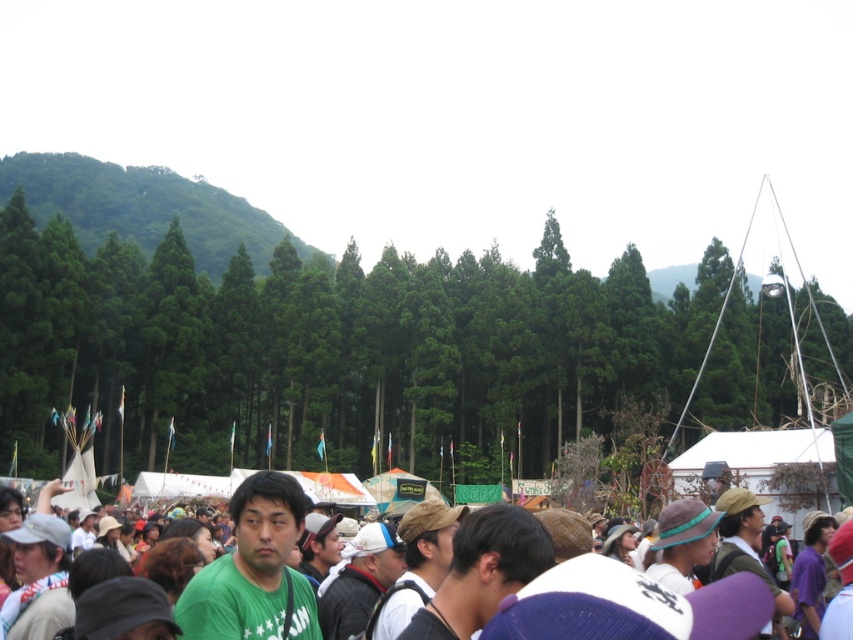
You are standing at the origin point of the coordinate system in the image. You want to move towards the green fabric crowd at center. What direction should you move in?

The green fabric crowd at center is located at coordinate point 0.894 on the x axis and 0.572 on the y axis. Since you are at the origin point, you should move towards the positive x and positive y direction to reach it.

You are standing at the center of the crowd in the festival scene. You see a point marked at coordinates (254, 570). What object is located at this point?

The point at coordinates (254, 570) corresponds to the green matte shirt at center.